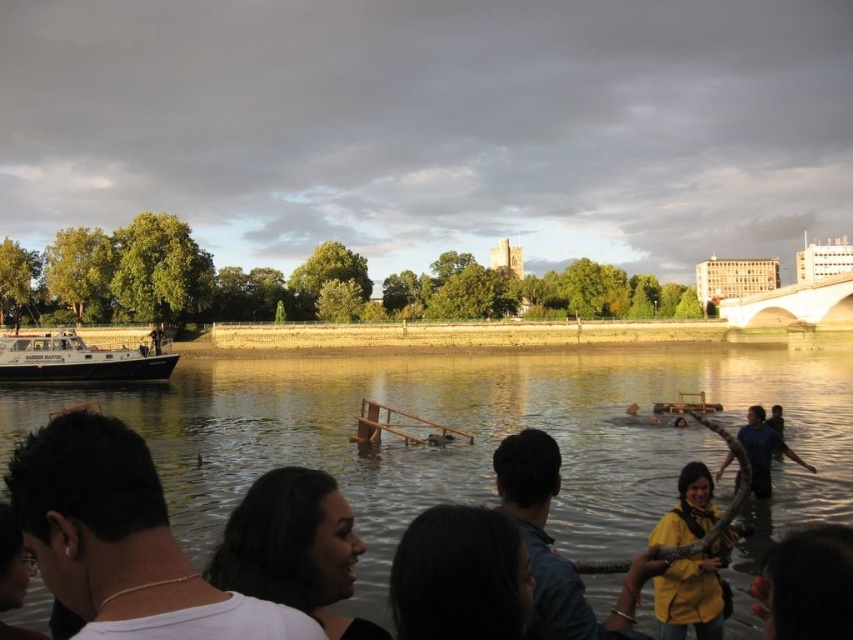
You are a photographer trying to capture a clear shot of the white matte shirt at lower left and the white matte boat at left. Given their sizes, which object should you focus on first to ensure it fits entirely within your camera frame?

The white matte shirt at lower left is bigger than the white matte boat at left, so you should focus on capturing the white matte shirt at lower left first to ensure it fits entirely within your camera frame.

You are a photographer positioned at the riverside trying to capture a clear shot of the white matte shirt at lower left and the white matte boat at left. Since both are white, you want to adjust your camera settings to ensure they are distinguishable. Which object should you focus on first to avoid blurring due to their positions?

The white matte shirt at lower left is located below the white matte boat at left, so focusing on the white matte boat at left first would ensure it stays in frame while adjusting for the shirt below.

You are a photographer positioned at the center of the riverbank. You want to capture both the white matte shirt at lower left and the yellow matte jacket at lower right in a single shot without moving your camera. Given that your camera has a maximum horizontal field of view of 60 degrees, can you fit both subjects into the frame?

The white matte shirt at lower left and yellow matte jacket at lower right are 85.66 feet apart. To determine if they can fit within a 60 degree field of view, we need to calculate the distance from the camera to the subjects. However, since the exact distance isn not provided, we can infer that if the subjects are 85.66 feet apart and positioned at the same distance from the camera, the required field of view would be larger than 60 degrees. Therefore, it might not be possible without moving the camera.